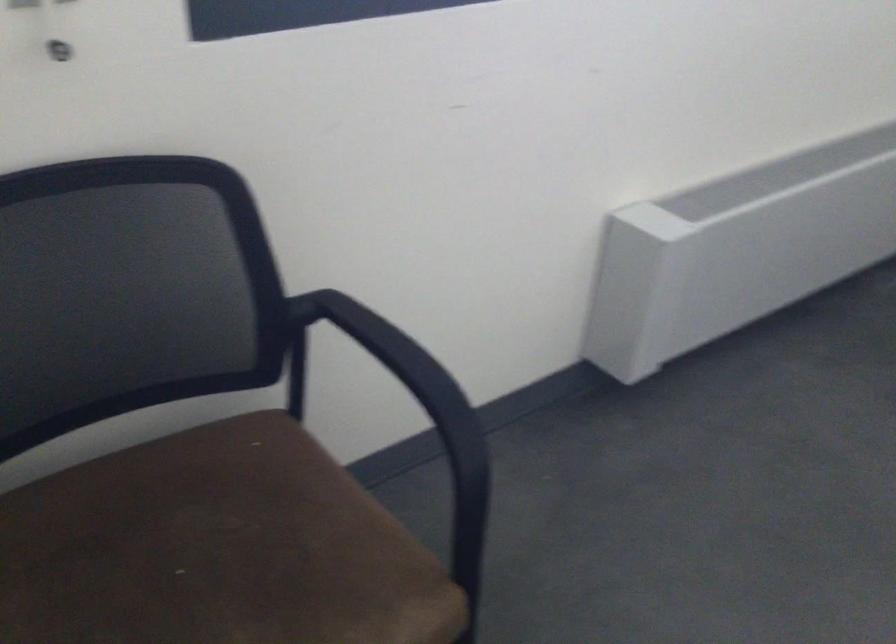
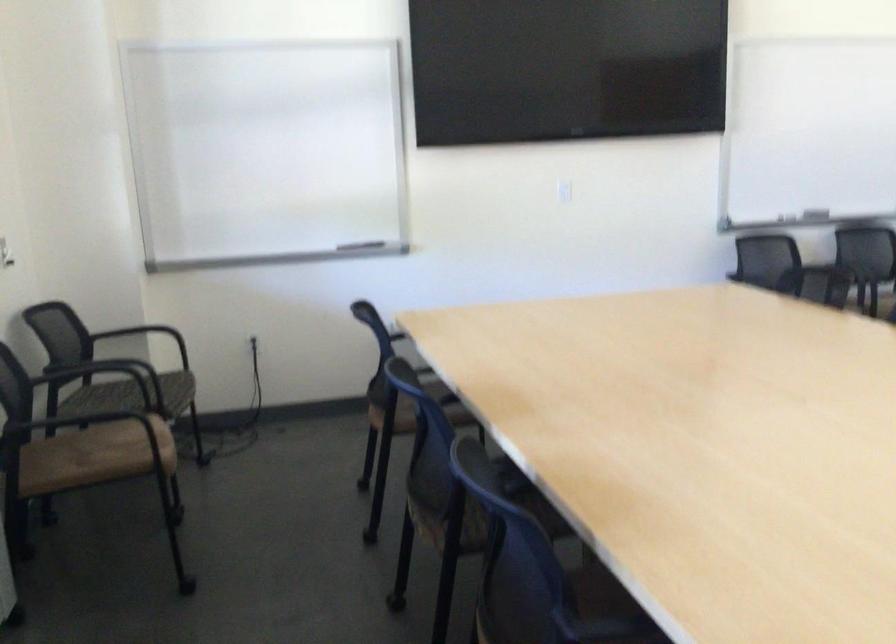
Question: The camera is either moving clockwise (left) or counter-clockwise (right) around the object. The first image is from the beginning of the video and the second image is from the end. Is the camera moving left or right when shooting the video?

Choices:
 (A) Left
 (B) Right

Answer: (A)